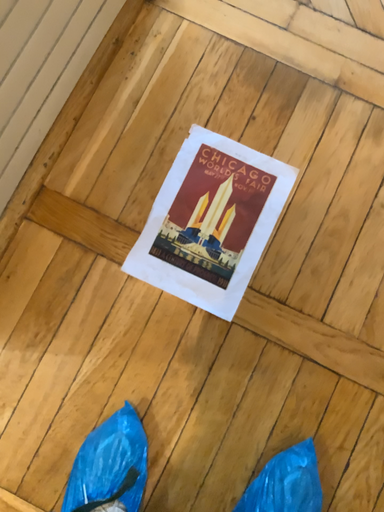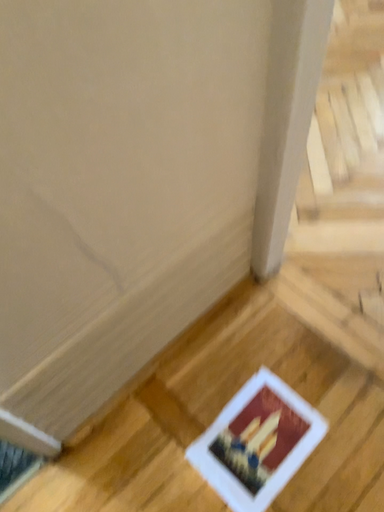
Question: Which way did the camera rotate in the video?

Choices:
 (A) rotated downward
 (B) rotated upward

Answer: (B)